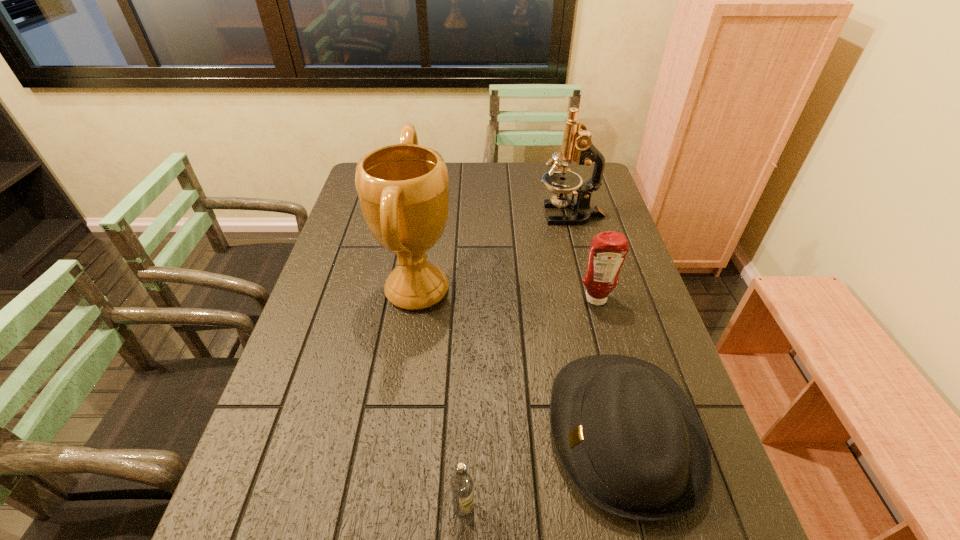
The width and height of the screenshot is (960, 540). Find the location of `free point between the leftmost object and the fedora`. free point between the leftmost object and the fedora is located at coordinates (520, 362).

Where is `free space between the third tallest object and the microscope`? This screenshot has width=960, height=540. free space between the third tallest object and the microscope is located at coordinates (584, 256).

Locate an element on the screen. vacant space in between the vodka and the third shortest object is located at coordinates (530, 404).

I want to click on vacant space that's between the fedora and the award, so click(x=520, y=362).

In order to click on free spot between the microscope and the award in this screenshot , I will do `click(494, 252)`.

Where is `free space between the farthest object and the award`? Image resolution: width=960 pixels, height=540 pixels. free space between the farthest object and the award is located at coordinates (x=494, y=252).

This screenshot has height=540, width=960. Identify the location of free spot between the fedora and the award. (520, 362).

The width and height of the screenshot is (960, 540). Find the location of `free area in between the award and the third shortest object`. free area in between the award and the third shortest object is located at coordinates (507, 295).

The height and width of the screenshot is (540, 960). Identify the location of unoccupied area between the award and the fedora. (520, 362).

Where is `object that stands as the closest to the fedora`? Image resolution: width=960 pixels, height=540 pixels. object that stands as the closest to the fedora is located at coordinates click(462, 483).